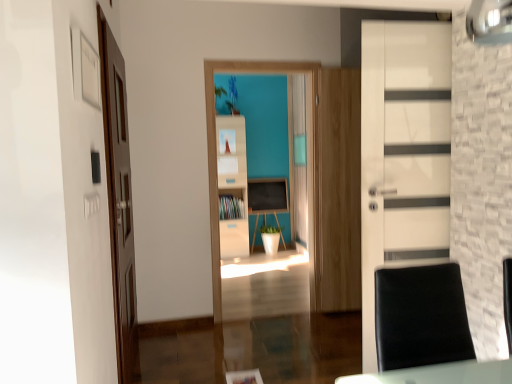
Question: Is matte wood cabinet at center thinner than black leather swivel chair at lower right?

Choices:
 (A) yes
 (B) no

Answer: (A)

Question: Is matte wood cabinet at center positioned beyond the bounds of black leather swivel chair at lower right?

Choices:
 (A) no
 (B) yes

Answer: (B)

Question: Is matte wood cabinet at center to the left of black leather swivel chair at lower right from the viewer's perspective?

Choices:
 (A) no
 (B) yes

Answer: (B)

Question: Does matte wood cabinet at center lie behind black leather swivel chair at lower right?

Choices:
 (A) no
 (B) yes

Answer: (B)

Question: Is matte wood cabinet at center taller than black leather swivel chair at lower right?

Choices:
 (A) yes
 (B) no

Answer: (B)

Question: In the image, is black leather swivel chair at lower right positioned in front of or behind white glossy door at right, which is counted as the 1th door, starting from the right?

Choices:
 (A) behind
 (B) front

Answer: (B)

Question: Would you say black leather swivel chair at lower right is inside or outside white glossy door at right, which is counted as the 1th door, starting from the right?

Choices:
 (A) outside
 (B) inside

Answer: (A)

Question: Is black leather swivel chair at lower right wider or thinner than white glossy door at right, the second door when ordered from left to right?

Choices:
 (A) wide
 (B) thin

Answer: (A)

Question: From a real-world perspective, is black leather swivel chair at lower right above or below white glossy door at right, the second door when ordered from left to right?

Choices:
 (A) below
 (B) above

Answer: (A)

Question: From a real-world perspective, relative to matte black chalkboard at center, is green matte plant at center vertically above or below?

Choices:
 (A) below
 (B) above

Answer: (B)

Question: In the image, is green matte plant at center on the left side or the right side of matte black chalkboard at center?

Choices:
 (A) right
 (B) left

Answer: (B)

Question: Is point (234, 104) positioned closer to the camera than point (261, 195)?

Choices:
 (A) closer
 (B) farther

Answer: (B)

Question: In the image, is green matte plant at center positioned in front of or behind matte black chalkboard at center?

Choices:
 (A) behind
 (B) front

Answer: (B)

Question: In terms of size, does white glossy door at right, the second door when ordered from left to right, appear bigger or smaller than white matte bookshelf at center?

Choices:
 (A) small
 (B) big

Answer: (B)

Question: Is white glossy door at right, the second door when ordered from left to right, inside or outside of white matte bookshelf at center?

Choices:
 (A) inside
 (B) outside

Answer: (B)